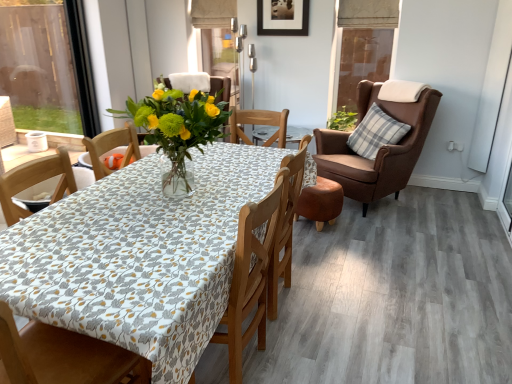
Question: Choose the correct answer: Is green leafy plant at center inside transparent glass window screen at upper right or outside it?

Choices:
 (A) outside
 (B) inside

Answer: (A)

Question: From their relative heights in the image, would you say green leafy plant at center is taller or shorter than transparent glass window screen at upper right?

Choices:
 (A) short
 (B) tall

Answer: (A)

Question: Which object is positioned closest to the plaid fabric pillow at right?

Choices:
 (A) brown leather armchair at right, the 1th chair from the right
 (B) black matte picture frame at upper center
 (C) green leafy plant at center
 (D) wooden chair at center, the 1th chair from the front
 (E) translucent glass vase at center

Answer: (A)

Question: Which is nearer to the transparent glass window screen at upper right?

Choices:
 (A) translucent glass vase at center
 (B) green leafy plant at center
 (C) wooden chair at center, the 1th chair from the front
 (D) brown leather armchair at right, arranged as the second chair when viewed from the front
 (E) plaid fabric pillow at right

Answer: (B)